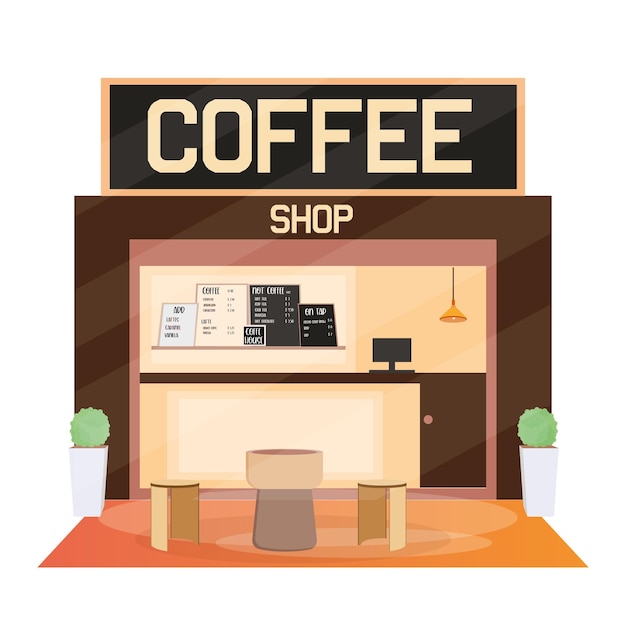
This screenshot has width=626, height=626. Find the location of `rug`. rug is located at coordinates (468, 533).